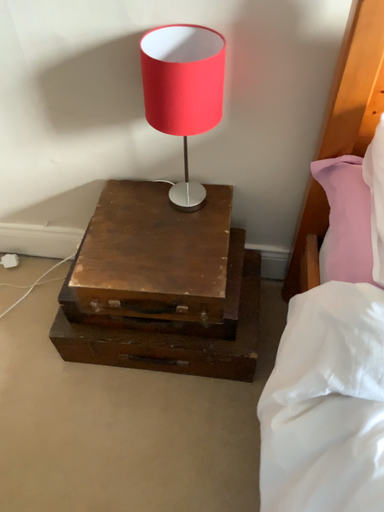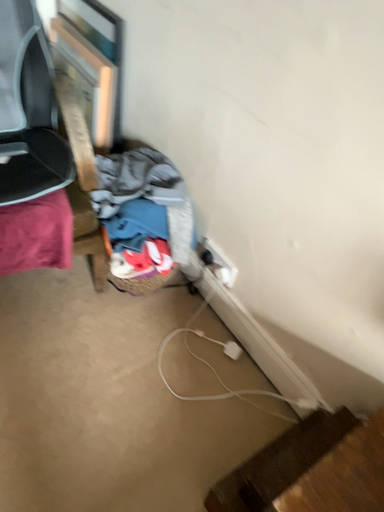
Question: How did the camera likely rotate when shooting the video?

Choices:
 (A) rotated upward
 (B) rotated downward

Answer: (A)